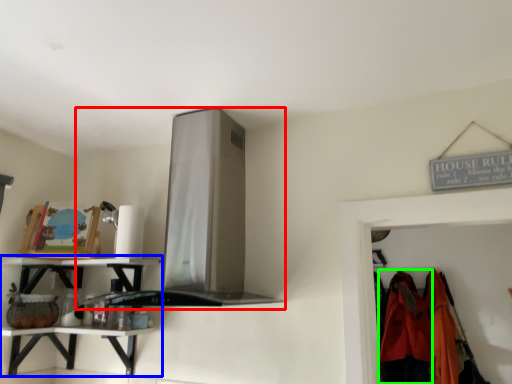
Question: Which is nearer to the exhaust hood (highlighted by a red box)? shelf (highlighted by a blue box) or clothing (highlighted by a green box).

Choices:
 (A) shelf
 (B) clothing

Answer: (A)